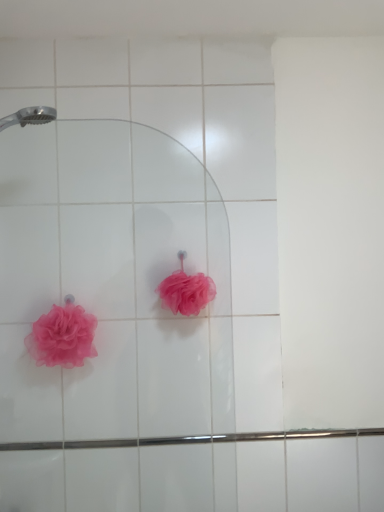
Question: Which direction should I rotate to face pink matte loofah at center, which appears as the second rose when viewed from the left, — up or down?

Choices:
 (A) down
 (B) up

Answer: (A)

Question: Would you consider pink matte loofah at center, which appears as the second rose when viewed from the left, to be distant from pink mesh sponge at lower left, the second rose in the right-to-left sequence?

Choices:
 (A) yes
 (B) no

Answer: (B)

Question: Is pink matte loofah at center, which appears as the second rose when viewed from the left, taller than pink mesh sponge at lower left, the first rose when ordered from left to right?

Choices:
 (A) no
 (B) yes

Answer: (A)

Question: Can pink mesh sponge at lower left, the second rose in the right-to-left sequence, be found inside pink matte loofah at center, which appears as the second rose when viewed from the left?

Choices:
 (A) yes
 (B) no

Answer: (B)

Question: Is pink matte loofah at center, marked as the first rose in a right-to-left arrangement, thinner than pink mesh sponge at lower left, the second rose in the right-to-left sequence?

Choices:
 (A) no
 (B) yes

Answer: (A)

Question: Does pink matte loofah at center, marked as the first rose in a right-to-left arrangement, have a smaller size compared to pink mesh sponge at lower left, the second rose in the right-to-left sequence?

Choices:
 (A) yes
 (B) no

Answer: (A)

Question: Is pink matte loofah at center, marked as the first rose in a right-to-left arrangement, outside of pink mesh sponge at lower left, the first rose when ordered from left to right?

Choices:
 (A) yes
 (B) no

Answer: (A)

Question: Is pink mesh sponge at lower left, the second rose in the right-to-left sequence, to the right of pink matte loofah at center, which appears as the second rose when viewed from the left, from the viewer's perspective?

Choices:
 (A) yes
 (B) no

Answer: (B)

Question: Does pink mesh sponge at lower left, the second rose in the right-to-left sequence, have a greater width compared to pink matte loofah at center, marked as the first rose in a right-to-left arrangement?

Choices:
 (A) yes
 (B) no

Answer: (B)

Question: Does pink mesh sponge at lower left, the second rose in the right-to-left sequence, have a larger size compared to pink matte loofah at center, which appears as the second rose when viewed from the left?

Choices:
 (A) no
 (B) yes

Answer: (B)

Question: Could pink matte loofah at center, marked as the first rose in a right-to-left arrangement, be considered to be inside pink mesh sponge at lower left, the first rose when ordered from left to right?

Choices:
 (A) no
 (B) yes

Answer: (A)

Question: Does pink mesh sponge at lower left, the first rose when ordered from left to right, have a smaller size compared to pink matte loofah at center, marked as the first rose in a right-to-left arrangement?

Choices:
 (A) no
 (B) yes

Answer: (A)

Question: From the image's perspective, does pink mesh sponge at lower left, the first rose when ordered from left to right, appear higher than pink matte loofah at center, marked as the first rose in a right-to-left arrangement?

Choices:
 (A) yes
 (B) no

Answer: (B)

Question: In terms of height, does pink matte loofah at center, which appears as the second rose when viewed from the left, look taller or shorter compared to pink mesh sponge at lower left, the second rose in the right-to-left sequence?

Choices:
 (A) short
 (B) tall

Answer: (A)